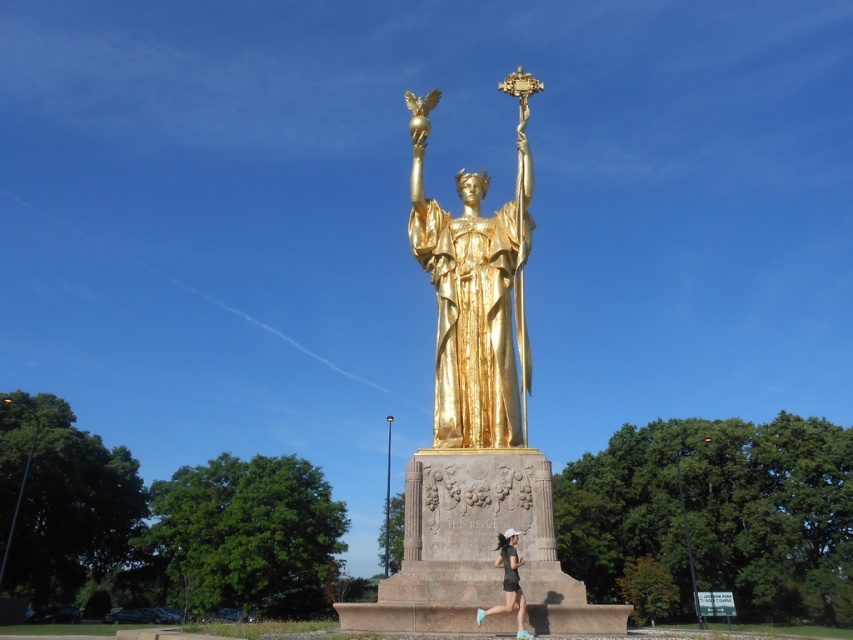
You are standing at the point marked by the coordinates point [476,420]. Looking around, you see the gold polished statue at center. Which direction should you face to see the golden eagle held by the statue?

The point [476,420] marks the gold polished statue at center, so you are already at the statue. To see the golden eagle held by the statue, you should face the direction where the statue is holding it, which is likely the front or one of its sides depending on the statue design.

You are a photographer planning to take a photo of the gold polished statue at center. You are currently standing at a distance of 100 feet away from the statue. If you want to get a closer shot without moving your position, which camera setting adjustment would help you capture the statue more prominently in the frame?

To capture the gold polished statue at center more prominently in the frame without moving closer, you can adjust your camera to a longer focal length. This will magnify the statue and make it appear larger in the photo despite being 93.57 feet away from the camera.

You are standing at the base of the golden statue and want to reach the point marked at coordinates point (500, 513). If you walk directly towards it, how far will you have to walk?

The point (500, 513) is 107.68 feet away from the viewer, so you will have to walk 107.68 feet to reach it.